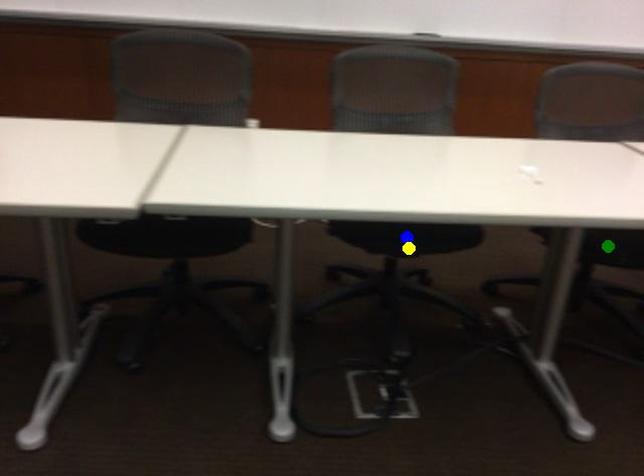
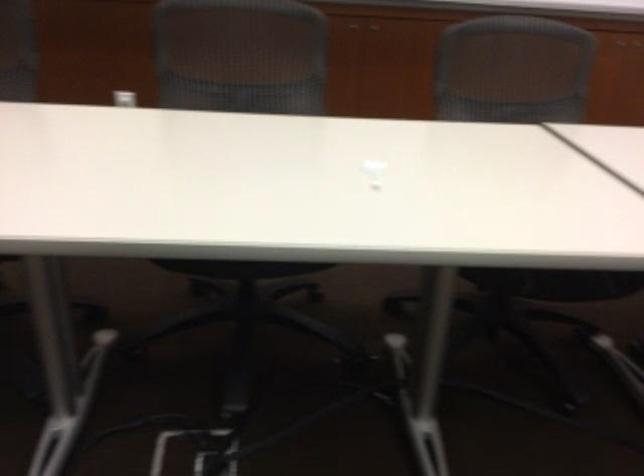
I am providing you with two images of the same scene from different viewpoints. Three points are marked in image1. Which point corresponds to a part or object that is occluded in image2?In image1, three points are marked. Which of them correspond to a part or object that is occluded in image2?Among the three points shown in image1, which one corresponds to a part or object that is no longer visible due to occlusion in image2?

blue point, green point cannot be seen in image2.